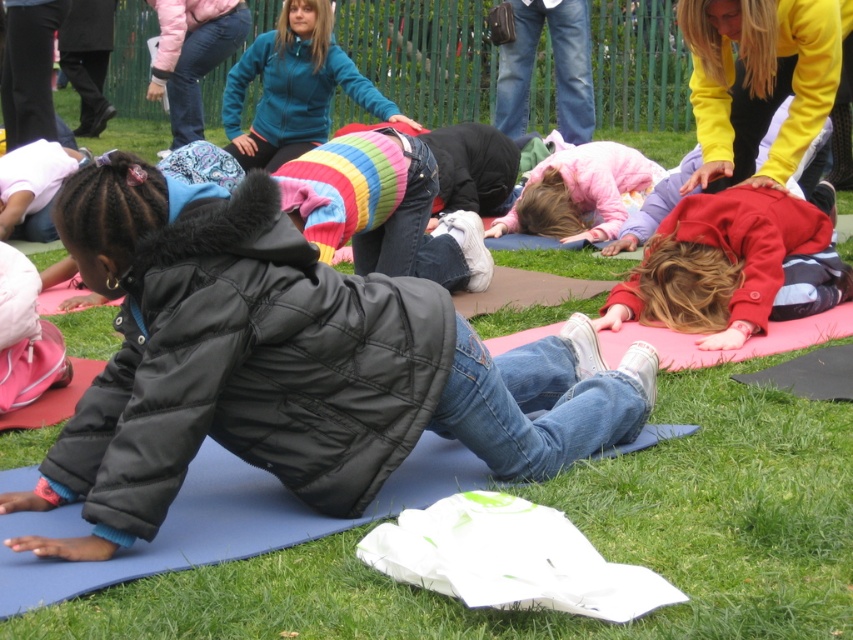
You are a photographer trying to capture the children in the yoga class. You notice two points in the image labeled as point 1 at coordinates point (x=378, y=416) and point 2 at coordinates point (x=717, y=244). Which point is closer to you?

Point (x=378, y=416) is closer to the viewer than point (x=717, y=244).

You are a photographer trying to capture both the black quilted jacket at center and the matte black jacket at lower left in a single shot. Based on their positions, which jacket is closer to the camera?

The black quilted jacket at center is located below the matte black jacket at lower left, meaning it is closer to the camera.

You are a photographer trying to capture a photo of the striped sweater at center and the pink fleece jacket at center. Based on their positions, which one should you focus on first to ensure both are in frame?

The striped sweater at center is above the pink fleece jacket at center, so you should focus on the pink fleece jacket at center first to ensure both are in frame.